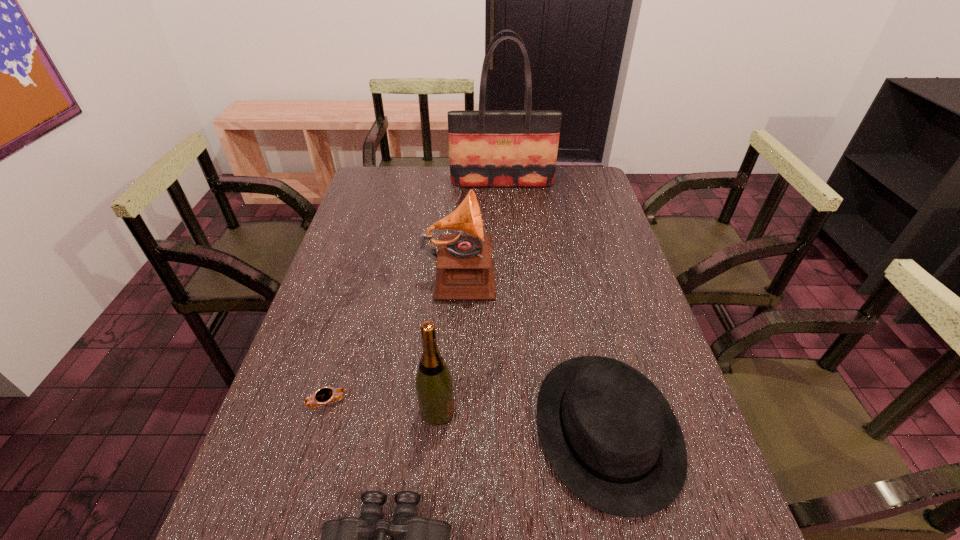
What are the coordinates of `shopping bag` in the screenshot? It's located at (486, 148).

Locate an element on the screen. the farthest object is located at coordinates (486, 148).

Where is `phonograph record`? phonograph record is located at coordinates (465, 268).

In order to click on wine bottle in this screenshot , I will do `click(434, 385)`.

Find the location of a particular element. fedora is located at coordinates (610, 435).

Find the location of a particular element. The height and width of the screenshot is (540, 960). the shortest object is located at coordinates (326, 395).

The width and height of the screenshot is (960, 540). Find the location of `watch`. watch is located at coordinates (326, 395).

Where is `vacant region located on the front-facing side of the farthest object`? vacant region located on the front-facing side of the farthest object is located at coordinates (506, 237).

Where is `free location located 0.300m on the horn of the phonograph record`? The width and height of the screenshot is (960, 540). free location located 0.300m on the horn of the phonograph record is located at coordinates (594, 273).

Identify the location of vacant space located 0.360m on the front-facing side of the wine bottle. This screenshot has width=960, height=540. (616, 411).